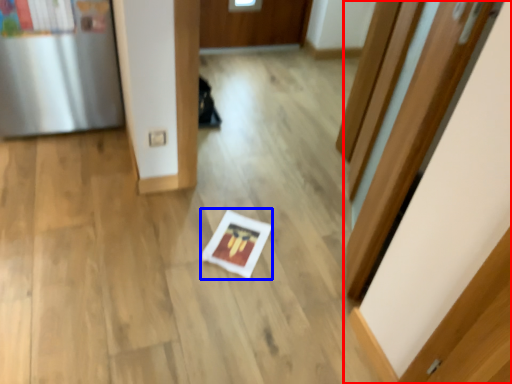
Question: Which object appears farthest to the camera in this image, door (highlighted by a red box) or copy (highlighted by a blue box)?

Choices:
 (A) door
 (B) copy

Answer: (B)